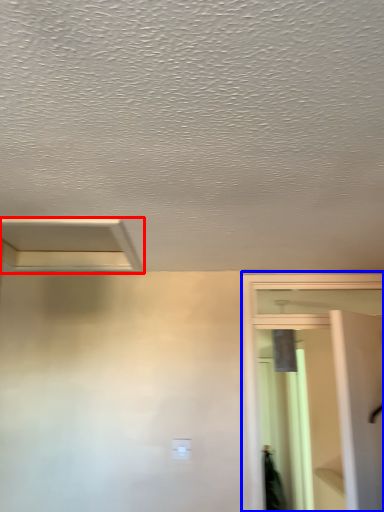
Question: Which object is further to the camera taking this photo, exhaust hood (highlighted by a red box) or screen door (highlighted by a blue box)?

Choices:
 (A) exhaust hood
 (B) screen door

Answer: (B)